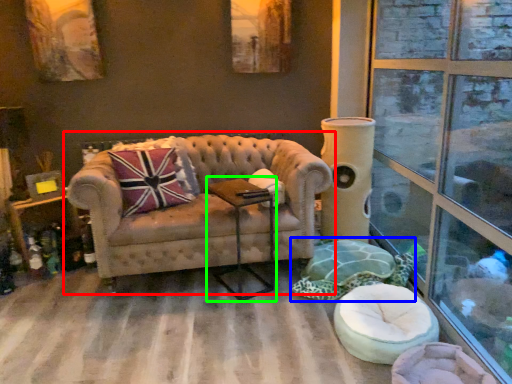
Question: Estimate the real-world distances between objects in this image. Which object is closer to studio couch (highlighted by a red box), swivel chair (highlighted by a blue box) or side table (highlighted by a green box)?

Choices:
 (A) swivel chair
 (B) side table

Answer: (B)